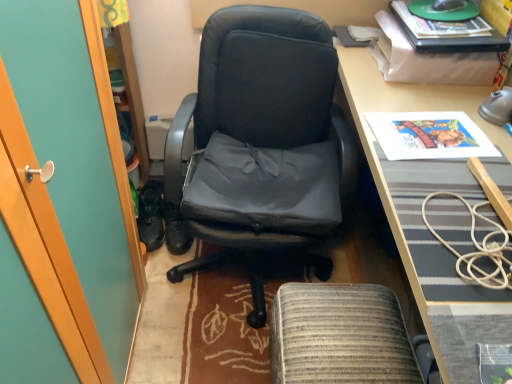
Question: Can you confirm if black leather chair at center is positioned to the right of printed paper poster at upper right?

Choices:
 (A) no
 (B) yes

Answer: (A)

Question: Can you confirm if black leather chair at center is positioned to the left of printed paper poster at upper right?

Choices:
 (A) yes
 (B) no

Answer: (A)

Question: Is printed paper poster at upper right at the back of black leather chair at center?

Choices:
 (A) yes
 (B) no

Answer: (B)

Question: Is black leather chair at center smaller than printed paper poster at upper right?

Choices:
 (A) yes
 (B) no

Answer: (B)

Question: Considering the relative sizes of black leather chair at center and printed paper poster at upper right in the image provided, is black leather chair at center wider than printed paper poster at upper right?

Choices:
 (A) no
 (B) yes

Answer: (B)

Question: Can you confirm if black leather chair at center is shorter than printed paper poster at upper right?

Choices:
 (A) no
 (B) yes

Answer: (A)

Question: Is printed paper poster at upper right located within woven fabric footrest at lower center?

Choices:
 (A) yes
 (B) no

Answer: (B)

Question: Is woven fabric footrest at lower center bigger than printed paper poster at upper right?

Choices:
 (A) yes
 (B) no

Answer: (A)

Question: Is woven fabric footrest at lower center smaller than printed paper poster at upper right?

Choices:
 (A) yes
 (B) no

Answer: (B)

Question: Is woven fabric footrest at lower center further to camera compared to printed paper poster at upper right?

Choices:
 (A) yes
 (B) no

Answer: (B)

Question: From a real-world perspective, is woven fabric footrest at lower center on top of printed paper poster at upper right?

Choices:
 (A) no
 (B) yes

Answer: (A)

Question: Is woven fabric footrest at lower center turned away from printed paper poster at upper right?

Choices:
 (A) yes
 (B) no

Answer: (B)

Question: Is woven fabric footrest at lower center oriented away from black plastic mouse at upper right?

Choices:
 (A) no
 (B) yes

Answer: (A)